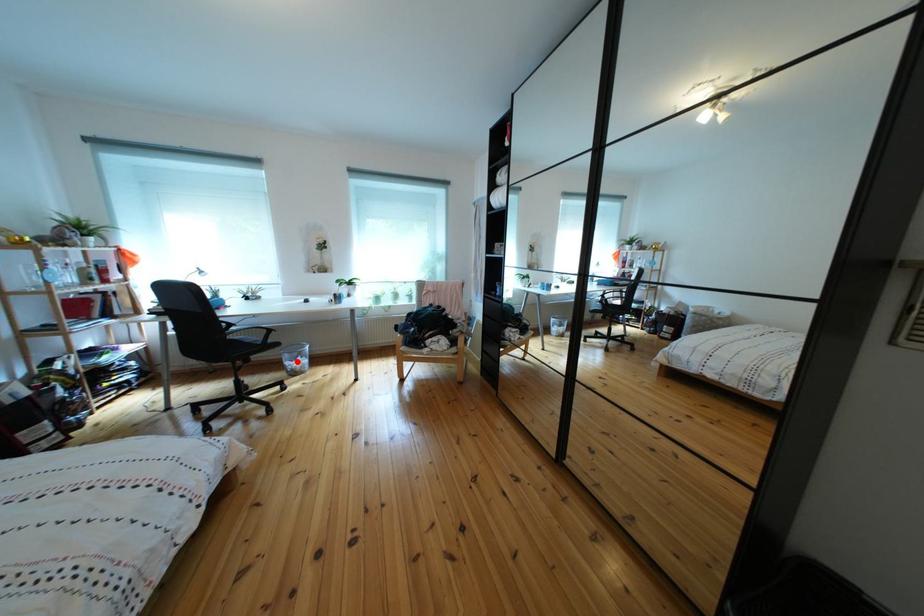
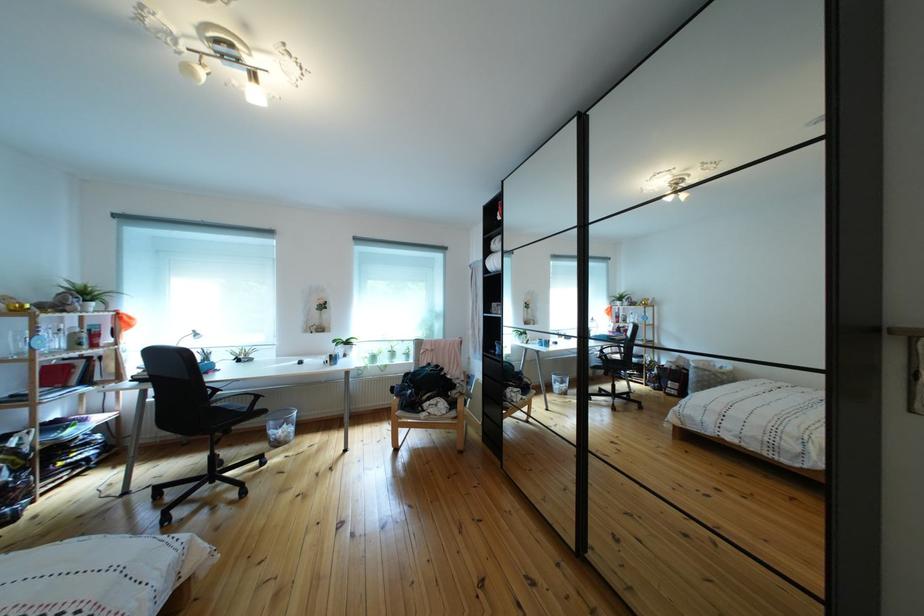
In the second image, find the point that corresponds to the highlighted location in the first image.

(283, 430)